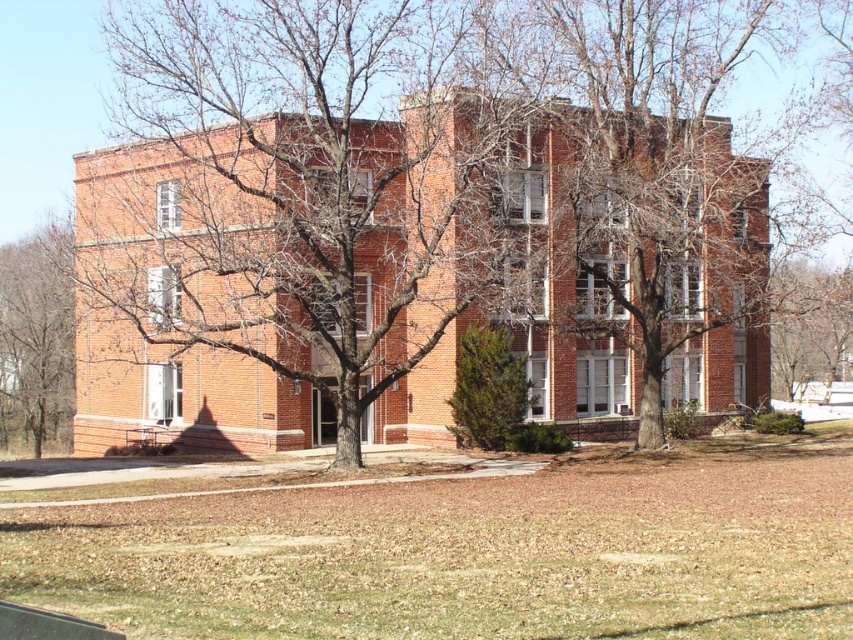
Question: Which point is farther to the camera?

Choices:
 (A) (33, 317)
 (B) (498, 268)

Answer: (A)

Question: Can you confirm if brown bark tree at center is positioned above bare branches at left?

Choices:
 (A) no
 (B) yes

Answer: (B)

Question: Can you confirm if brown bark tree at center is positioned to the left of bare branches at left?

Choices:
 (A) no
 (B) yes

Answer: (A)

Question: Which point is closer to the camera?

Choices:
 (A) brown bark tree at center
 (B) bare branches at left

Answer: (A)

Question: Is brown bark tree at center positioned at the back of bare branches at left?

Choices:
 (A) yes
 (B) no

Answer: (B)